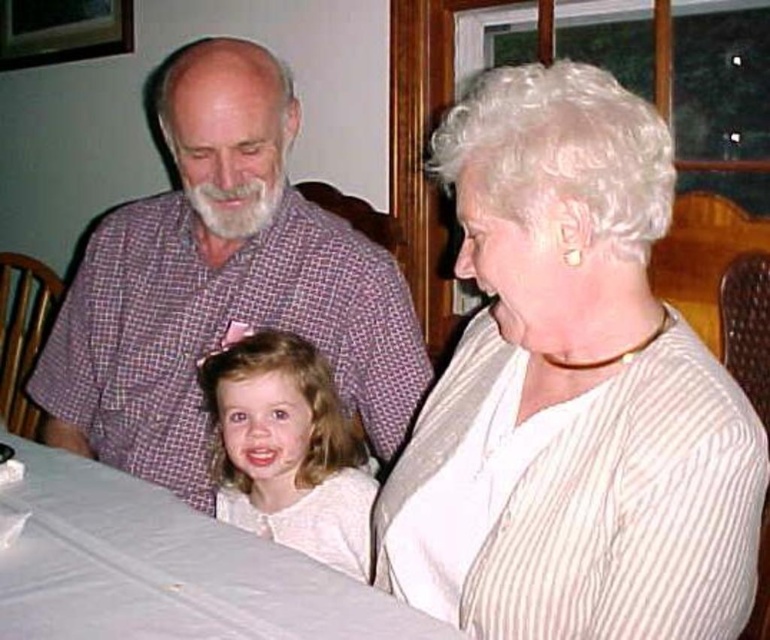
Who is shorter, purple checkered shirt at upper left or white plastic table at lower left?

white plastic table at lower left is shorter.

Is purple checkered shirt at upper left shorter than white plastic table at lower left?

Incorrect, purple checkered shirt at upper left's height does not fall short of white plastic table at lower left's.

The image size is (770, 640). I want to click on purple checkered shirt at upper left, so click(219, 284).

Is purple checkered shirt at upper left behind blonde hair at center?

Yes.

Does purple checkered shirt at upper left appear under blonde hair at center?

No.

Is point (223, 147) positioned after point (360, 557)?

That is True.

Find the location of `purple checkered shirt at upper left`. purple checkered shirt at upper left is located at coordinates (219, 284).

Is white striped blouse at upper right positioned at the back of purple checkered shirt at upper left?

No, it is not.

Between white striped blouse at upper right and purple checkered shirt at upper left, which one appears on the right side from the viewer's perspective?

white striped blouse at upper right is more to the right.

Is point (625, 474) positioned after point (350, 266)?

No, (625, 474) is closer to viewer.

The height and width of the screenshot is (640, 770). In order to click on white striped blouse at upper right in this screenshot , I will do `click(571, 392)`.